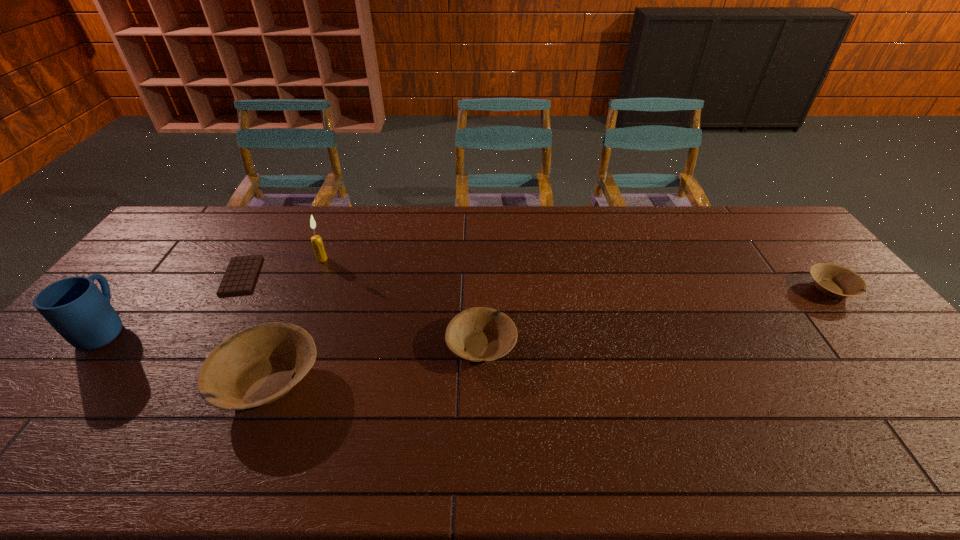
Find the location of a particular element. Image resolution: width=960 pixels, height=540 pixels. free spot located on the right of the leftmost bowl is located at coordinates (353, 381).

Where is `free space located on the left of the second bowl from right to left`? The height and width of the screenshot is (540, 960). free space located on the left of the second bowl from right to left is located at coordinates (305, 346).

Where is `vacant position located on the back of the second shortest object`? vacant position located on the back of the second shortest object is located at coordinates (778, 227).

Where is `vacant space located on the right of the candle`? vacant space located on the right of the candle is located at coordinates pos(394,259).

Image resolution: width=960 pixels, height=540 pixels. I want to click on free location located 0.200m on the side of the leftmost object with the handle, so click(x=161, y=262).

Find the location of `vacant space located on the side of the leftmost object with the handle`. vacant space located on the side of the leftmost object with the handle is located at coordinates (172, 249).

Find the location of a particular element. blank area located on the side of the leftmost object with the handle is located at coordinates (188, 230).

I want to click on vacant region located on the back of the chocolate bar, so click(x=273, y=222).

Locate an element on the screen. This screenshot has width=960, height=540. object at the near edge is located at coordinates (256, 366).

At what (x,y) coordinates should I click in order to perform the action: click on object that is at the left edge. Please return your answer as a coordinate pair (x, y). Looking at the image, I should click on (75, 307).